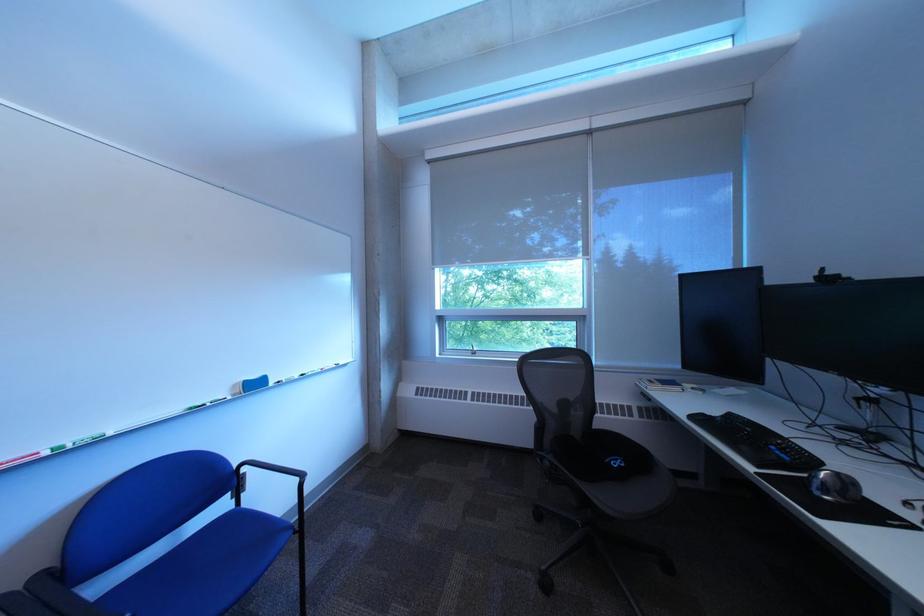
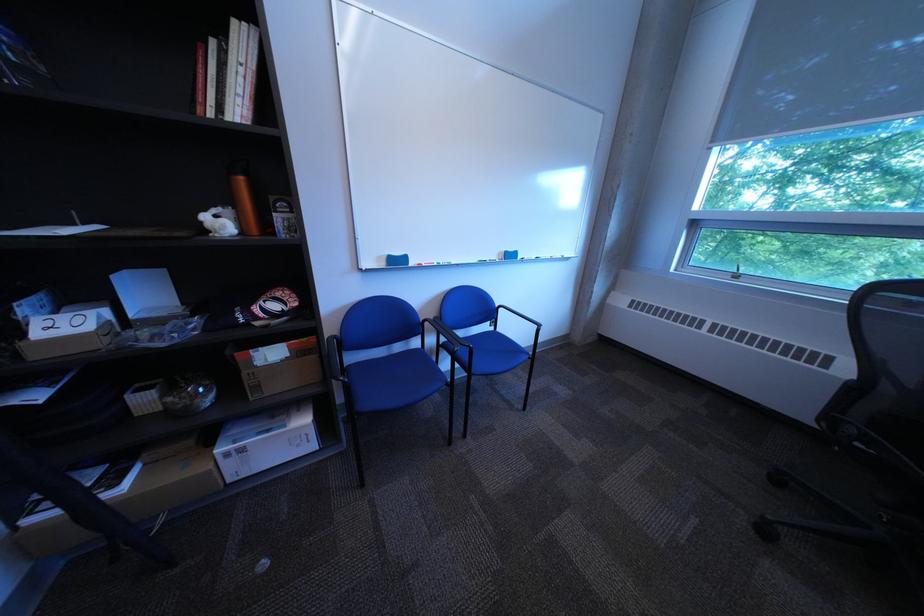
The first image is from the beginning of the video and the second image is from the end. How did the camera likely rotate when shooting the video?

The camera rotated toward left-down.